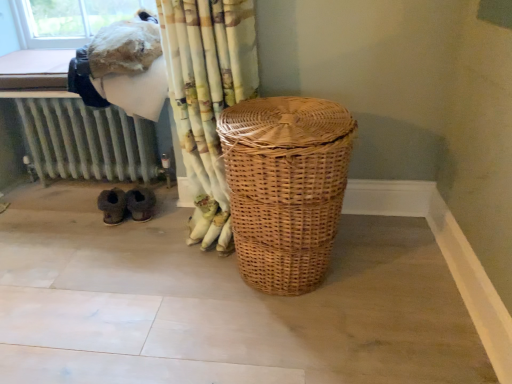
Find the location of `vacant space in front of metallic radiator at lower left`. vacant space in front of metallic radiator at lower left is located at coordinates click(x=88, y=252).